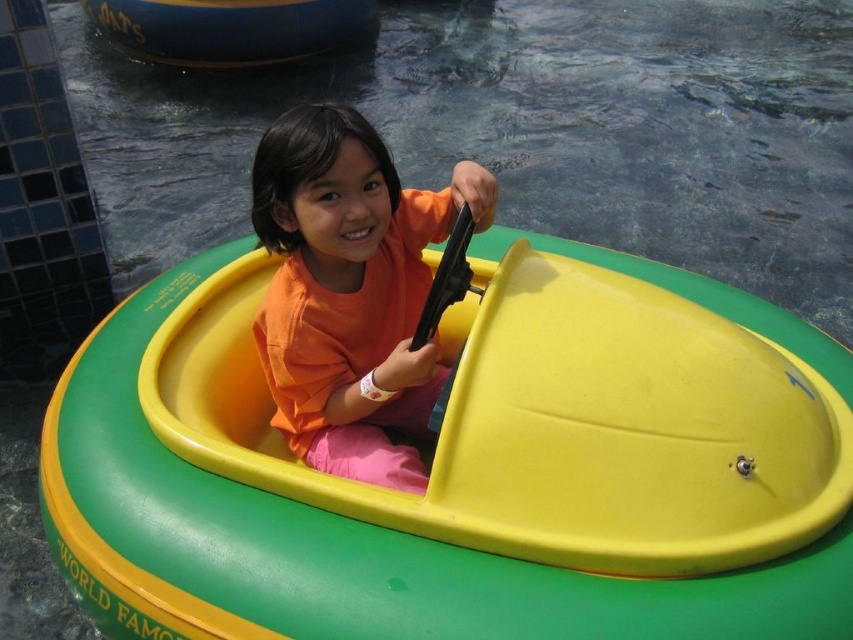
Is orange matte shirt at center smaller than blue rubber boat at upper left?

Indeed, orange matte shirt at center has a smaller size compared to blue rubber boat at upper left.

Who is lower down, orange matte shirt at center or blue rubber boat at upper left?

Positioned lower is orange matte shirt at center.

Is point (328, 307) less distant than point (260, 44)?

Yes, it is.

Where is `orange matte shirt at center`? The height and width of the screenshot is (640, 853). orange matte shirt at center is located at coordinates click(x=350, y=291).

Is yellow matte plastic boat at center positioned in front of blue rubber boat at upper left?

Yes, it is in front of blue rubber boat at upper left.

Is point (386, 536) in front of point (225, 32)?

That is True.

The image size is (853, 640). What do you see at coordinates (459, 468) in the screenshot?
I see `yellow matte plastic boat at center` at bounding box center [459, 468].

At what (x,y) coordinates should I click in order to perform the action: click on yellow matte plastic boat at center. Please return your answer as a coordinate pair (x, y). Image resolution: width=853 pixels, height=640 pixels. Looking at the image, I should click on (459, 468).

Which of these two, yellow matte plastic boat at center or orange matte shirt at center, stands taller?

yellow matte plastic boat at center

Does point (746, 337) come in front of point (355, 384)?

Yes, it is in front of point (355, 384).

Locate an element on the screen. This screenshot has width=853, height=640. yellow matte plastic boat at center is located at coordinates (459, 468).